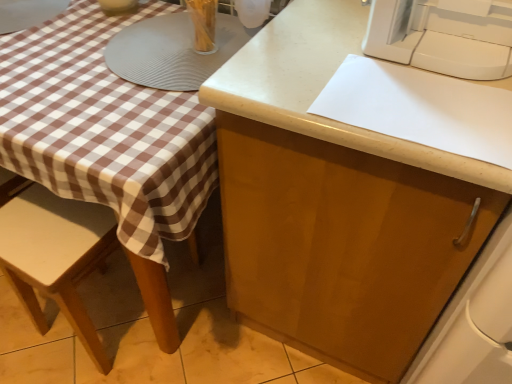
The width and height of the screenshot is (512, 384). In order to click on free location above wooden chair at lower left (from a real-world perspective) in this screenshot , I will do `click(49, 226)`.